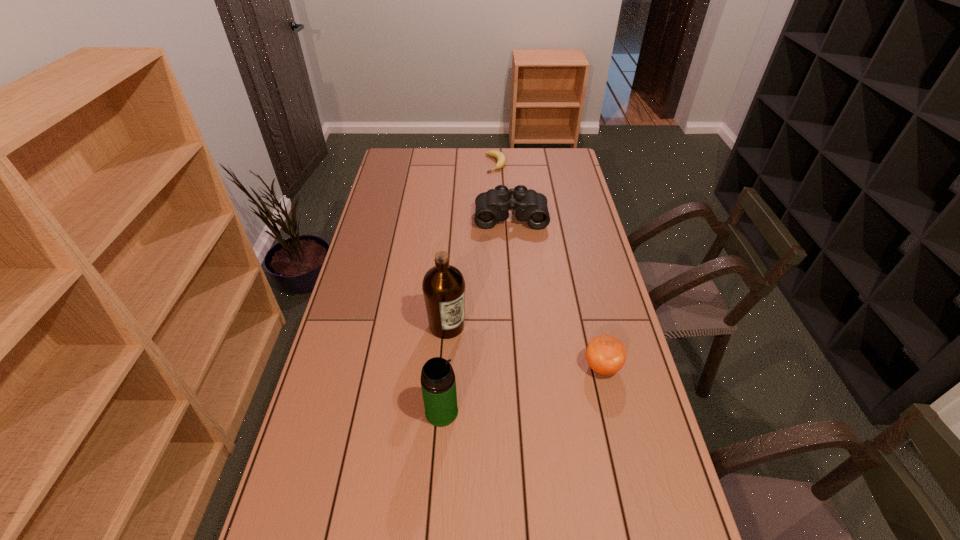
What are the coordinates of `free spot between the binoculars and the second tallest object` in the screenshot? It's located at (476, 314).

In order to click on vacant region between the third farthest object and the shortest object in this screenshot , I will do `click(471, 245)`.

This screenshot has width=960, height=540. In order to click on free spot between the orange and the olive oil in this screenshot , I will do `click(524, 346)`.

Locate an element on the screen. Image resolution: width=960 pixels, height=540 pixels. blank region between the third farthest object and the farthest object is located at coordinates (x=471, y=245).

You are a GUI agent. You are given a task and a screenshot of the screen. Output one action in this format:
    pyautogui.click(x=<x>, y=<y>)
    Task: Click on the object identified as the fourth closest to the thermos bottle
    The image size is (960, 540).
    Given the screenshot: What is the action you would take?
    pyautogui.click(x=498, y=155)

This screenshot has width=960, height=540. I want to click on object that is the closest one to the tallest object, so click(438, 383).

Find the location of a particular element. vacant space that satisfies the following two spatial constraints: 1. on the back side of the binoculars; 2. on the left side of the third nearest object is located at coordinates (455, 215).

You are a GUI agent. You are given a task and a screenshot of the screen. Output one action in this format:
    pyautogui.click(x=<x>, y=<y>)
    Task: Click on the free point that satisfies the following two spatial constraints: 1. on the front side of the third farthest object; 2. from the spout of the second tallest object
    Image resolution: width=960 pixels, height=540 pixels.
    Given the screenshot: What is the action you would take?
    pyautogui.click(x=441, y=412)